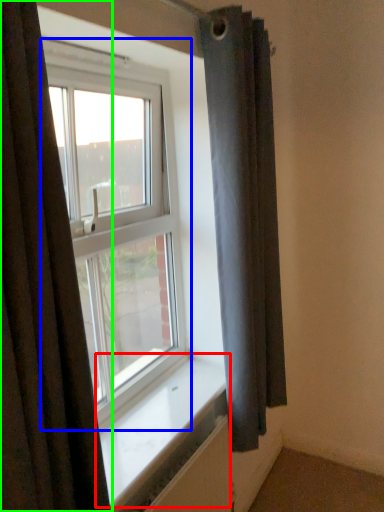
Question: Which object is positioned closest to window sill (highlighted by a red box)? Select from window (highlighted by a blue box) and curtain (highlighted by a green box).

Choices:
 (A) window
 (B) curtain

Answer: (A)